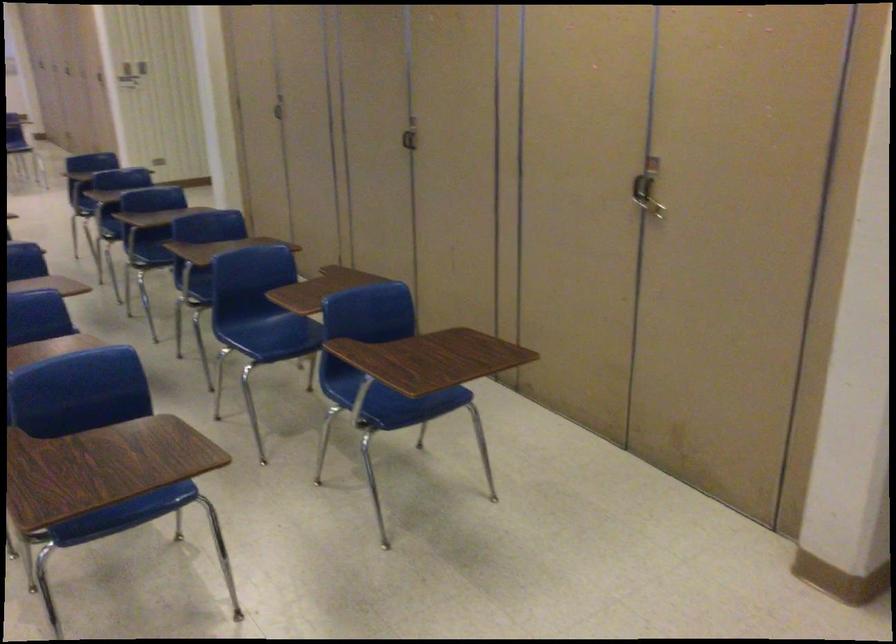
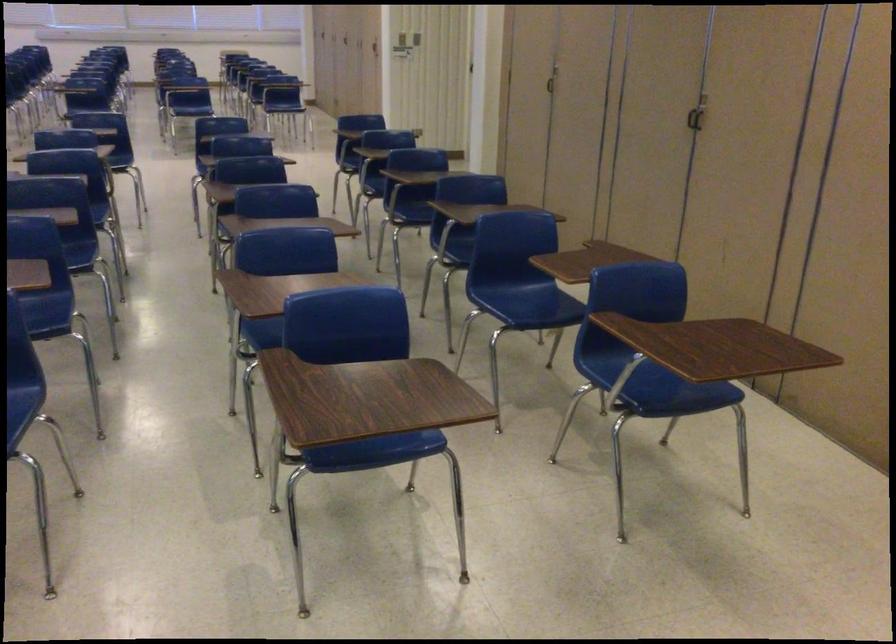
The images are taken continuously from a first-person perspective. In which direction are you moving?

The cameraman moved toward left, forward.